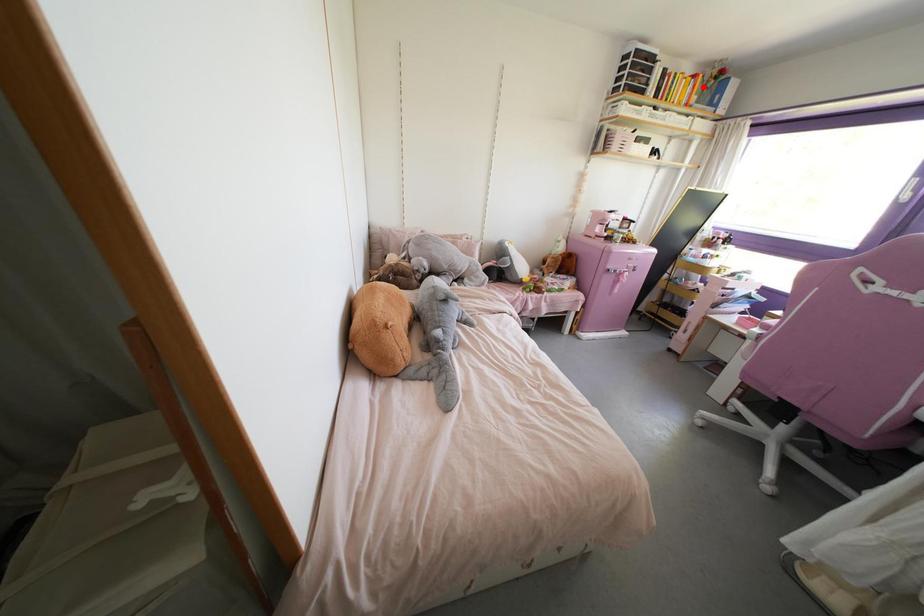
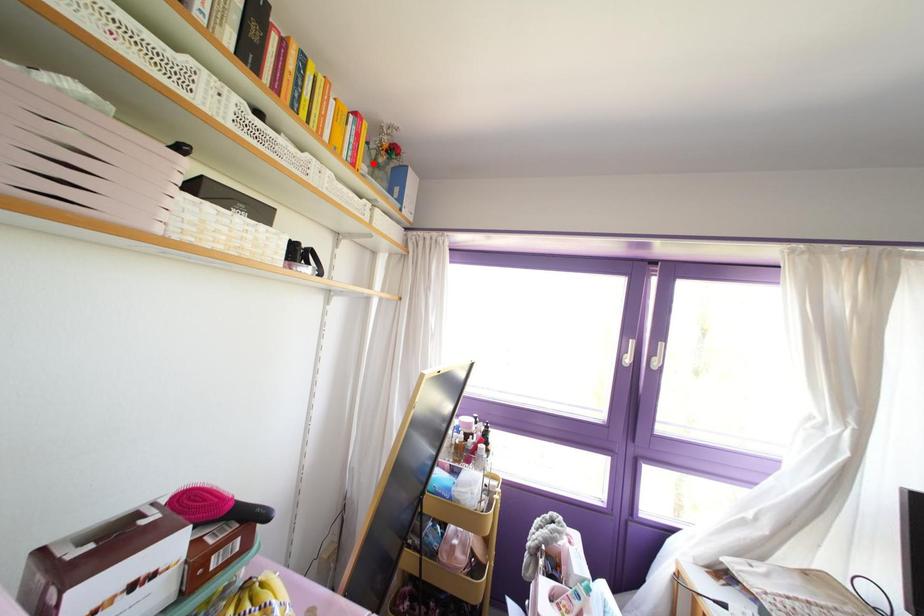
I am providing you with two images of the same scene from different viewpoints. A red point is marked on the first image and another point is marked on the second image. Is the red point in image1 aligned with the point shown in image2?

Yes